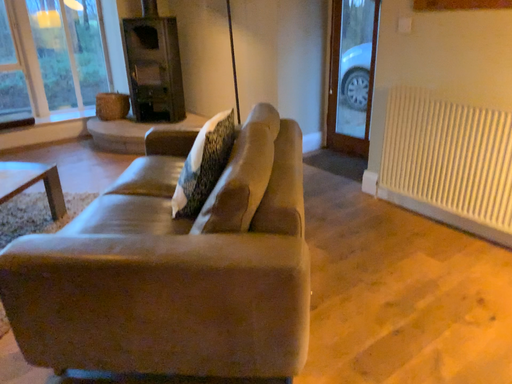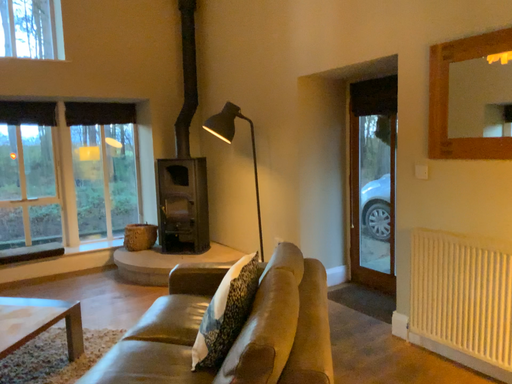
Question: Which way did the camera rotate in the video?

Choices:
 (A) rotated downward
 (B) rotated upward

Answer: (B)